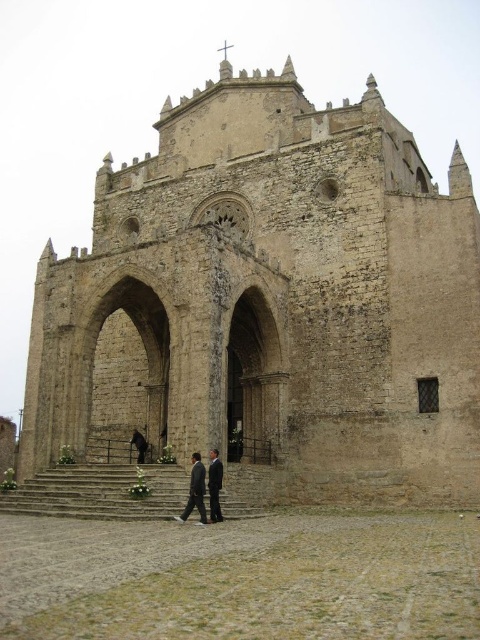
Between stone steps at center and dark suit at center, which one appears on the right side from the viewer's perspective?

From the viewer's perspective, dark suit at center appears more on the right side.

Who is lower down, stone steps at center or dark suit at center?

stone steps at center

What do you see at coordinates (99, 492) in the screenshot? This screenshot has height=640, width=480. I see `stone steps at center` at bounding box center [99, 492].

At what (x,y) coordinates should I click in order to perform the action: click on stone steps at center. Please return your answer as a coordinate pair (x, y). The image size is (480, 640). Looking at the image, I should click on (99, 492).

Is dark gray suit at center to the left of dark suit at center from the viewer's perspective?

Incorrect, dark gray suit at center is not on the left side of dark suit at center.

Does dark gray suit at center have a lesser height compared to dark suit at center?

Indeed, dark gray suit at center has a lesser height compared to dark suit at center.

Measure the distance between dark gray suit at center and camera.

They are 43.88 meters apart.

The image size is (480, 640). I want to click on dark gray suit at center, so click(195, 490).

Can you confirm if beige stone church at center is smaller than dark suit at center?

No.

Between point (305, 330) and point (213, 461), which one is positioned in front?

Positioned in front is point (213, 461).

Image resolution: width=480 pixels, height=640 pixels. In order to click on beige stone church at center in this screenshot , I will do `click(271, 301)`.